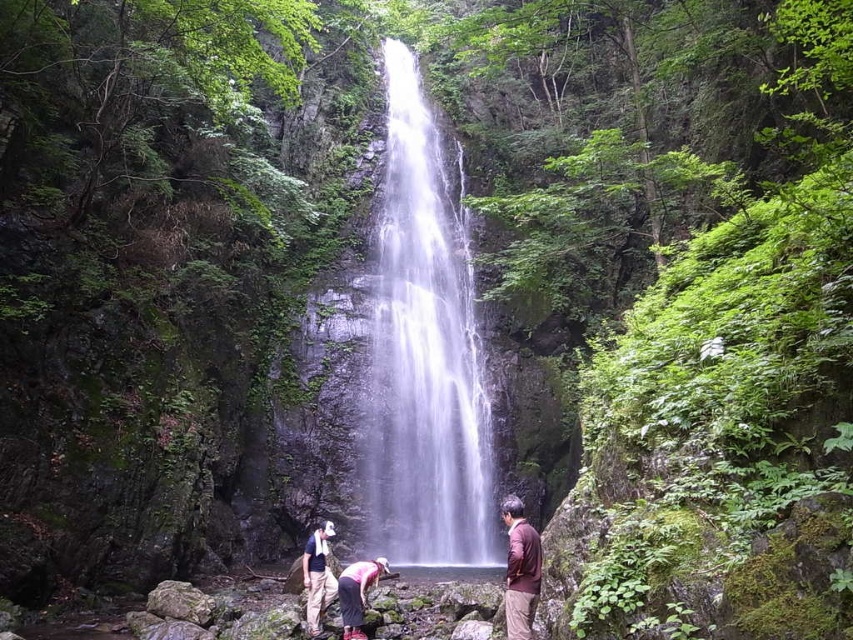
Question: Among these points, which one is farthest from the camera?

Choices:
 (A) (453, 259)
 (B) (321, 636)
 (C) (350, 584)
 (D) (531, 532)

Answer: (A)

Question: Which of the following is the closest to the observer?

Choices:
 (A) (409, 308)
 (B) (309, 541)

Answer: (B)

Question: Is clear glass waterfall at center above dark brown leather jacket at lower center?

Choices:
 (A) no
 (B) yes

Answer: (B)

Question: Can you confirm if clear glass waterfall at center is positioned above dark brown leather jacket at lower center?

Choices:
 (A) no
 (B) yes

Answer: (B)

Question: Does clear glass waterfall at center appear on the right side of pink fabric pants at lower center?

Choices:
 (A) no
 (B) yes

Answer: (B)

Question: Which point is farther to the camera?

Choices:
 (A) (456, 248)
 (B) (502, 509)
 (C) (370, 564)
 (D) (312, 611)

Answer: (A)